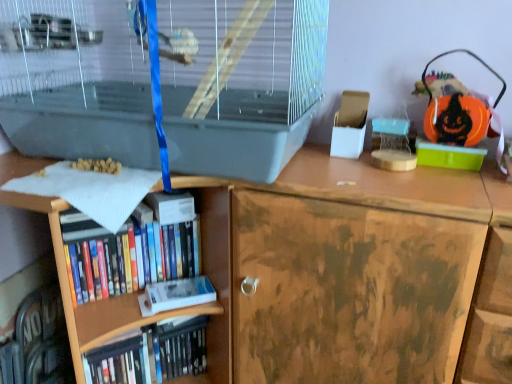
Question: Should I look upward or downward to see hardcover book at lower left, the first book ordered from the bottom?

Choices:
 (A) up
 (B) down

Answer: (B)

Question: From a real-world perspective, is hardcover books at lower left, which ranks as the 1th book in top-to-bottom order, located higher than hardcover book at center, positioned as the second paperback book in bottom-to-top order?

Choices:
 (A) no
 (B) yes

Answer: (A)

Question: Is hardcover books at lower left, the 2th book in the bottom-to-top sequence, positioned in front of hardcover book at center, positioned as the second paperback book in bottom-to-top order?

Choices:
 (A) yes
 (B) no

Answer: (A)

Question: From the image's perspective, is hardcover books at lower left, the 2th book in the bottom-to-top sequence, beneath hardcover book at center, positioned as the second paperback book in bottom-to-top order?

Choices:
 (A) no
 (B) yes

Answer: (B)

Question: Is hardcover books at lower left, the 2th book in the bottom-to-top sequence, facing towards hardcover book at center, the first paperback book positioned from the top?

Choices:
 (A) no
 (B) yes

Answer: (A)

Question: Is hardcover books at lower left, the 2th book in the bottom-to-top sequence, facing away from hardcover book at center, positioned as the second paperback book in bottom-to-top order?

Choices:
 (A) yes
 (B) no

Answer: (B)

Question: Can you confirm if hardcover books at lower left, the 2th book in the bottom-to-top sequence, is thinner than hardcover book at center, positioned as the second paperback book in bottom-to-top order?

Choices:
 (A) yes
 (B) no

Answer: (A)

Question: From the image's perspective, is white matte paperback book at lower left, acting as the 2th paperback book starting from the top, beneath hardcover book at center, the first paperback book positioned from the top?

Choices:
 (A) no
 (B) yes

Answer: (B)

Question: Does white matte paperback book at lower left, marked as the 1th paperback book in a bottom-to-top arrangement, have a greater height compared to hardcover book at center, the first paperback book positioned from the top?

Choices:
 (A) yes
 (B) no

Answer: (B)

Question: Is white matte paperback book at lower left, marked as the 1th paperback book in a bottom-to-top arrangement, next to hardcover book at center, positioned as the second paperback book in bottom-to-top order, and touching it?

Choices:
 (A) no
 (B) yes

Answer: (A)

Question: Is hardcover book at center, the first paperback book positioned from the top, at the back of white matte paperback book at lower left, acting as the 2th paperback book starting from the top?

Choices:
 (A) no
 (B) yes

Answer: (A)

Question: Considering the relative positions of white matte paperback book at lower left, marked as the 1th paperback book in a bottom-to-top arrangement, and hardcover book at center, positioned as the second paperback book in bottom-to-top order, in the image provided, is white matte paperback book at lower left, marked as the 1th paperback book in a bottom-to-top arrangement, to the right of hardcover book at center, positioned as the second paperback book in bottom-to-top order, from the viewer's perspective?

Choices:
 (A) yes
 (B) no

Answer: (A)

Question: Considering the relative sizes of white matte paperback book at lower left, acting as the 2th paperback book starting from the top, and hardcover book at center, the first paperback book positioned from the top, in the image provided, is white matte paperback book at lower left, acting as the 2th paperback book starting from the top, thinner than hardcover book at center, the first paperback book positioned from the top,?

Choices:
 (A) no
 (B) yes

Answer: (B)

Question: From a real-world perspective, does clear plastic birdcage at upper left sit lower than hardcover books at lower left, the 2th book in the bottom-to-top sequence?

Choices:
 (A) no
 (B) yes

Answer: (A)